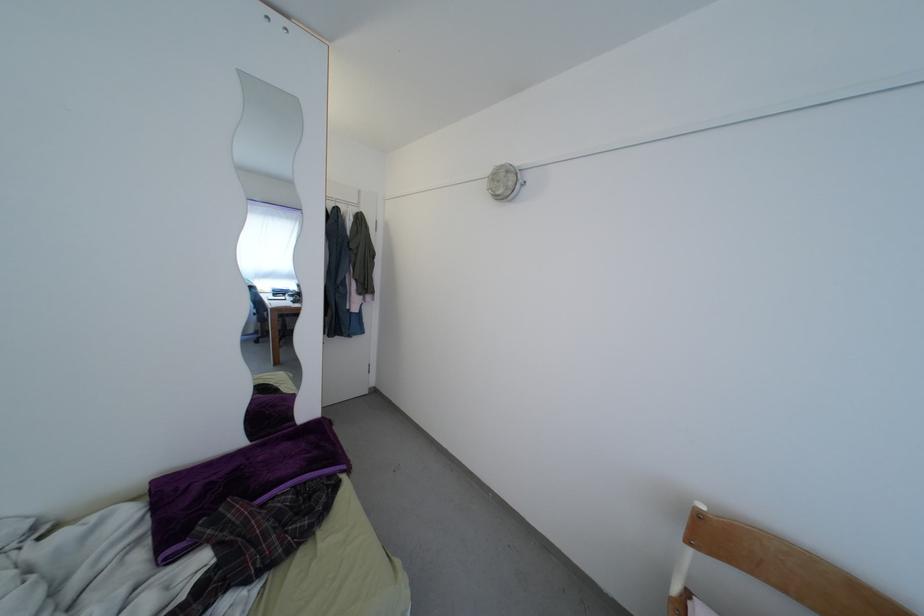
Where would you push the wavy door edge? Please return your answer as a coordinate pair (x, y).

(268, 264)